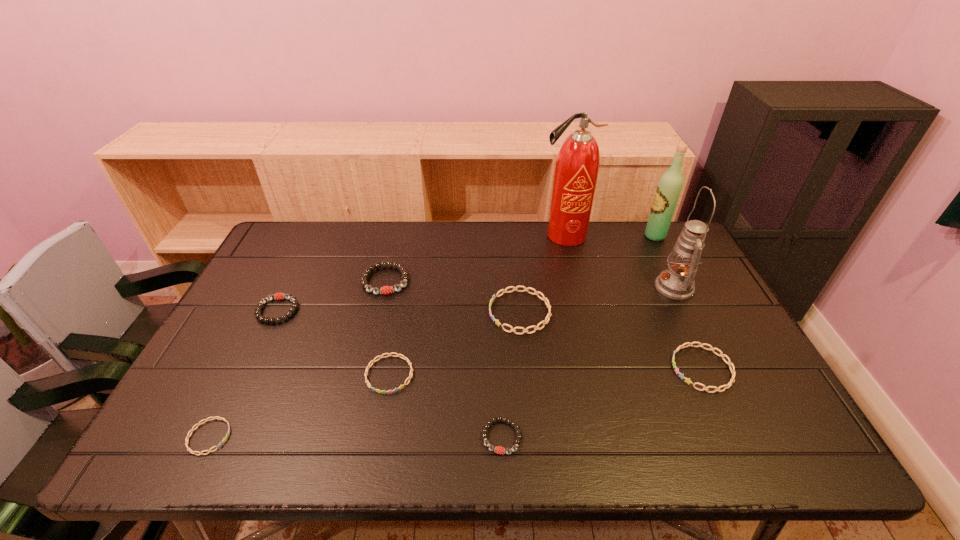
This screenshot has height=540, width=960. In order to click on free space located on the surface of the shortest object showing star-shaped elements in this screenshot , I will do `click(320, 437)`.

The image size is (960, 540). In order to click on fire extinguisher that is at the far edge in this screenshot , I will do `click(577, 166)`.

Where is `wine bottle that is at the far edge`? Image resolution: width=960 pixels, height=540 pixels. wine bottle that is at the far edge is located at coordinates (670, 185).

Find the location of `wine bottle located in the right edge section of the desktop`. wine bottle located in the right edge section of the desktop is located at coordinates (670, 185).

You are a GUI agent. You are given a task and a screenshot of the screen. Output one action in this format:
    pyautogui.click(x=<x>, y=<y>)
    Task: Click on the oil lamp located in the right edge section of the desktop
    The height and width of the screenshot is (540, 960).
    Given the screenshot: What is the action you would take?
    pyautogui.click(x=677, y=282)

Where is `bracelet that is positioned at the right edge`? This screenshot has height=540, width=960. bracelet that is positioned at the right edge is located at coordinates (722, 355).

Identify the location of object situated at the near left corner. (218, 418).

What are the coordinates of `object located in the far right corner section of the desktop` in the screenshot? It's located at (670, 185).

The width and height of the screenshot is (960, 540). Identify the location of free space at the far edge of the desktop. (536, 253).

In the image, there is a desktop. Where is `free region at the near edge`? The height and width of the screenshot is (540, 960). free region at the near edge is located at coordinates (266, 443).